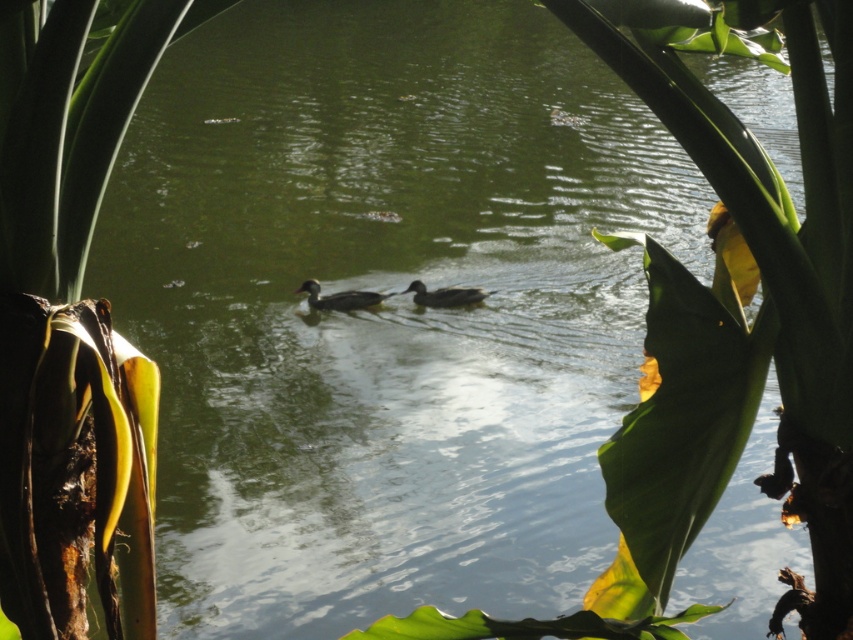
Question: Among these objects, which one is nearest to the camera?

Choices:
 (A) dark gray matte duck at center
 (B) dark brown glossy duck at center

Answer: (A)

Question: Among these points, which one is farthest from the camera?

Choices:
 (A) (432, 300)
 (B) (311, 294)

Answer: (B)

Question: Can you confirm if dark brown glossy duck at center is wider than dark gray matte duck at center?

Choices:
 (A) yes
 (B) no

Answer: (A)

Question: Does dark brown glossy duck at center have a larger size compared to dark gray matte duck at center?

Choices:
 (A) yes
 (B) no

Answer: (A)

Question: From the image, what is the correct spatial relationship of dark brown glossy duck at center in relation to dark gray matte duck at center?

Choices:
 (A) right
 (B) left

Answer: (B)